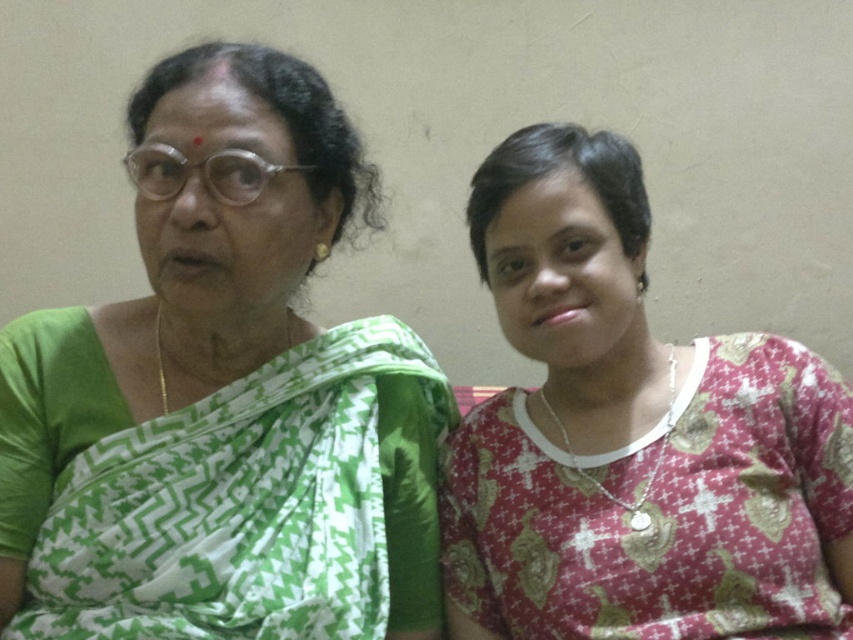
In the scene, there are two people sitting against a wall. The person on the left is wearing a green woven saree at left, and the person on the right is wearing a pink printed blouse at right. Which clothing item is bigger in size?

The green woven saree at left has a larger size compared to the pink printed blouse at right, so the green woven saree at left is bigger in size.

You are a photographer adjusting your camera to focus on the two people in the image. Which of the two items, the green woven saree at left or the pink printed blouse at right, should you adjust your focus to first if you want to ensure the closest object is sharp?

The green woven saree at left is closer to the viewer than the pink printed blouse at right, so you should focus on the green woven saree at left first to ensure it is sharp.